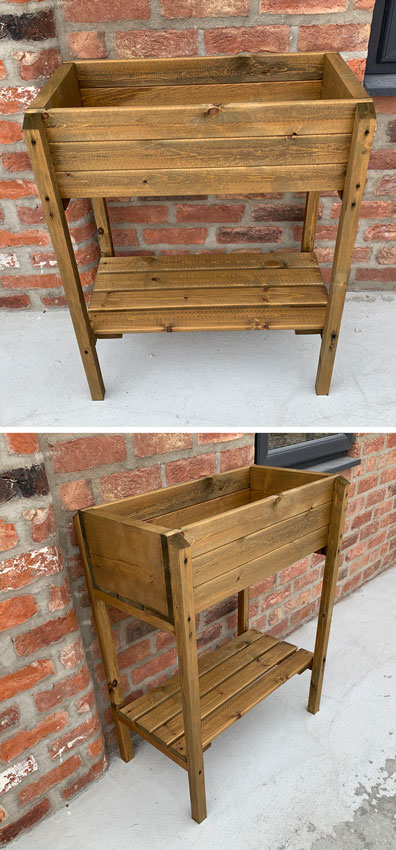
Where is `window`? The width and height of the screenshot is (396, 850). window is located at coordinates (288, 442).